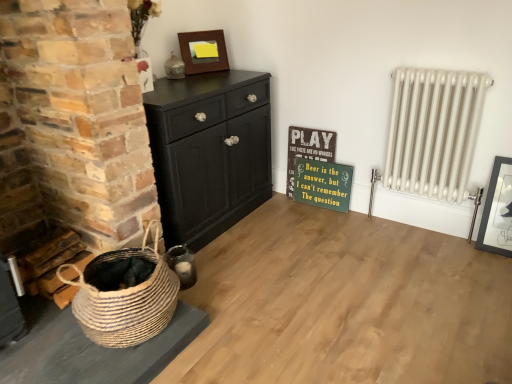
Question: Should I look upward or downward to see natural woven basket at lower left?

Choices:
 (A) up
 (B) down

Answer: (B)

Question: Does wooden signboard at center appear on the right side of white metal radiator at right?

Choices:
 (A) no
 (B) yes

Answer: (A)

Question: Is wooden signboard at center surrounding white metal radiator at right?

Choices:
 (A) yes
 (B) no

Answer: (B)

Question: Can you confirm if wooden signboard at center is shorter than white metal radiator at right?

Choices:
 (A) yes
 (B) no

Answer: (A)

Question: Considering the relative sizes of wooden signboard at center and white metal radiator at right in the image provided, is wooden signboard at center thinner than white metal radiator at right?

Choices:
 (A) no
 (B) yes

Answer: (B)

Question: Is wooden signboard at center directly adjacent to white metal radiator at right?

Choices:
 (A) no
 (B) yes

Answer: (A)

Question: From the image's perspective, is wooden signboard at center over white metal radiator at right?

Choices:
 (A) yes
 (B) no

Answer: (B)

Question: Is matte black picture frame at right, arranged as the 2th picture frame when viewed from the back, facing towards white metal radiator at right?

Choices:
 (A) yes
 (B) no

Answer: (B)

Question: From a real-world perspective, is matte black picture frame at right, acting as the first picture frame starting from the bottom, physically above white metal radiator at right?

Choices:
 (A) yes
 (B) no

Answer: (B)

Question: Considering the relative sizes of matte black picture frame at right, acting as the first picture frame starting from the bottom, and white metal radiator at right in the image provided, is matte black picture frame at right, acting as the first picture frame starting from the bottom, wider than white metal radiator at right?

Choices:
 (A) yes
 (B) no

Answer: (B)

Question: Are matte black picture frame at right, which ranks as the 2th picture frame in top-to-bottom order, and white metal radiator at right located far from each other?

Choices:
 (A) no
 (B) yes

Answer: (A)

Question: Is white metal radiator at right at the back of matte black picture frame at right, acting as the first picture frame starting from the bottom?

Choices:
 (A) no
 (B) yes

Answer: (A)

Question: Is white metal radiator at right completely or partially inside matte black picture frame at right, the 1th picture frame when ordered from front to back?

Choices:
 (A) no
 (B) yes

Answer: (A)

Question: Is green painted wood signboard at center-right looking in the opposite direction of wooden picture frame at upper center, placed as the 1th picture frame when sorted from top to bottom?

Choices:
 (A) yes
 (B) no

Answer: (B)